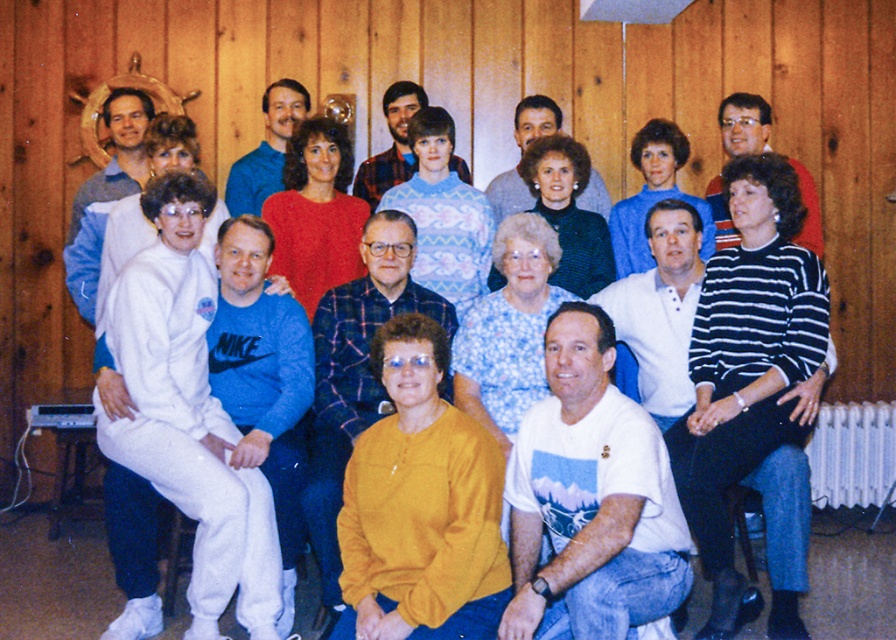
You are a photographer standing 2 meters away from the group. You want to take a closeup shot of the red sweater at center and the matte blue sweater at center. Can you capture both in a single frame without moving your camera? The camera has a 50mm lens which has a field of view of 46 degrees. The distance between you and the group is 2 meters. The distance between the two sweaters is 1.38 meters. Calculate if the sweaters fit within the field of view.

The field of view of a 50mm lens at 2 meters is approximately 2.2 meters wide. Since the distance between the red sweater at center and matte blue sweater at center is 1.38 meters, which is less than 2.2 meters, both sweaters can be captured in a single frame without moving the camera.